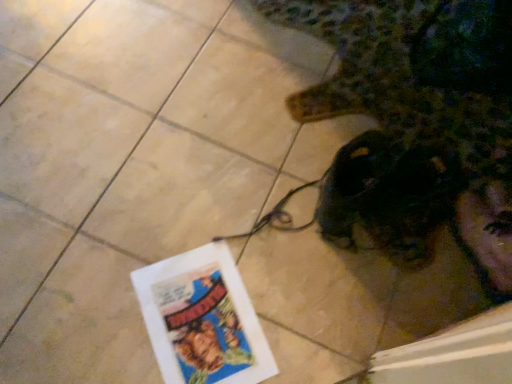
At what (x,y) coordinates should I click in order to perform the action: click on vacant space underneath white paper flyer at lower left (from a real-world perspective). Please return your answer as a coordinate pair (x, y). The height and width of the screenshot is (384, 512). Looking at the image, I should click on (199, 319).